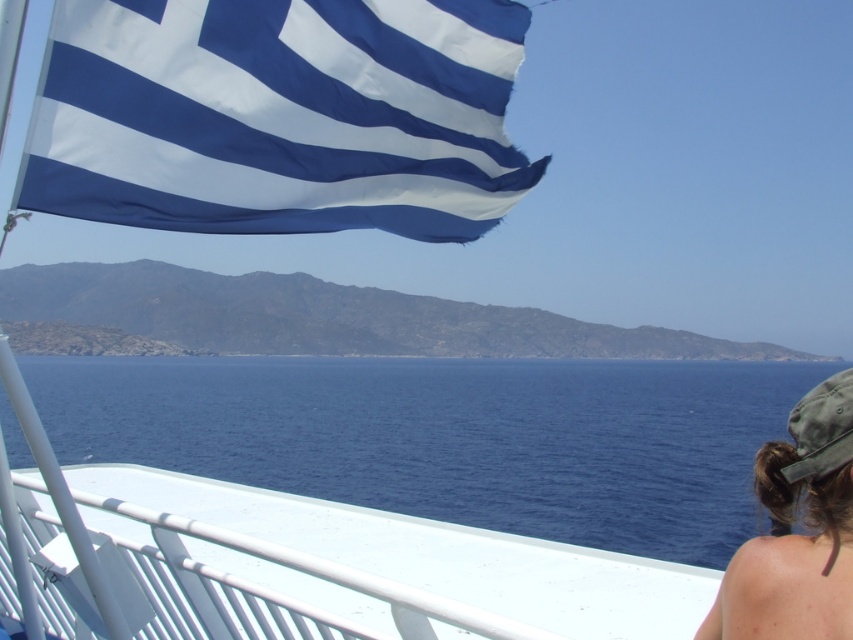
You are a sailor on the boat deck. You see the blue water at lower center and the brown hair at lower right. Which object is closer to you?

The blue water at lower center is closer to you because the brown hair at lower right is behind it.

You are a photographer on a boat deck. You want to capture a photo that includes both the blue fabric flag at upper left and the brown hair at lower right. Which object will appear bigger in the photo?

The blue fabric flag at upper left will appear bigger in the photo because it is larger in size than the brown hair at lower right.

You are standing on the boat deck and want to take a photo of the blue water at lower center and the blue fabric flag at upper left. Which object will appear larger in the photo?

The blue water at lower center will appear larger in the photo because it is closer to the camera than the blue fabric flag at upper left.